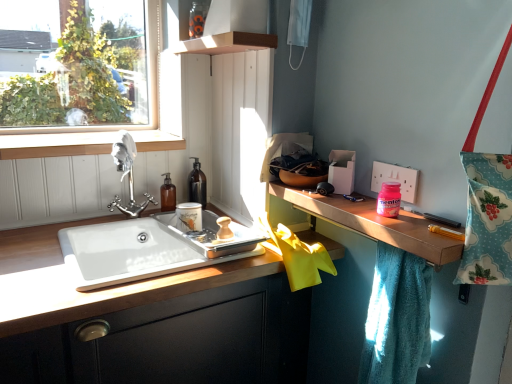
Question: Does pink glossy mentos at upper right, placed as the first toiletry when sorted from right to left, come in front of wooden at left?

Choices:
 (A) yes
 (B) no

Answer: (A)

Question: Is pink glossy mentos at upper right, which appears as the second toiletry when viewed from the left, further to the viewer compared to wooden at left?

Choices:
 (A) no
 (B) yes

Answer: (A)

Question: Considering the relative sizes of pink glossy mentos at upper right, the second toiletry when ordered from back to front, and wooden at left in the image provided, is pink glossy mentos at upper right, the second toiletry when ordered from back to front, bigger than wooden at left?

Choices:
 (A) no
 (B) yes

Answer: (A)

Question: From a real-world perspective, is pink glossy mentos at upper right, the first toiletry from the front, on top of wooden at left?

Choices:
 (A) yes
 (B) no

Answer: (B)

Question: Is pink glossy mentos at upper right, the second toiletry when ordered from back to front, placed right next to wooden at left?

Choices:
 (A) no
 (B) yes

Answer: (A)

Question: In the image, is teal soft towel at right on the left side or the right side of wooden cabinet at lower left?

Choices:
 (A) left
 (B) right

Answer: (B)

Question: From a real-world perspective, relative to wooden cabinet at lower left, is teal soft towel at right vertically above or below?

Choices:
 (A) above
 (B) below

Answer: (A)

Question: Is teal soft towel at right taller or shorter than wooden cabinet at lower left?

Choices:
 (A) short
 (B) tall

Answer: (A)

Question: Is teal soft towel at right inside or outside of wooden cabinet at lower left?

Choices:
 (A) inside
 (B) outside

Answer: (B)

Question: In terms of size, does wooden at right appear bigger or smaller than teal soft towel at right?

Choices:
 (A) small
 (B) big

Answer: (A)

Question: Looking at their shapes, would you say wooden at right is wider or thinner than teal soft towel at right?

Choices:
 (A) wide
 (B) thin

Answer: (A)

Question: Do you think wooden at right is within teal soft towel at right, or outside of it?

Choices:
 (A) outside
 (B) inside

Answer: (A)

Question: From the image's perspective, is wooden at right located above or below teal soft towel at right?

Choices:
 (A) below
 (B) above

Answer: (B)

Question: From the image's perspective, is black glass bottle at upper center located above or below wooden at left?

Choices:
 (A) below
 (B) above

Answer: (A)

Question: Is black glass bottle at upper center bigger or smaller than wooden at left?

Choices:
 (A) small
 (B) big

Answer: (A)